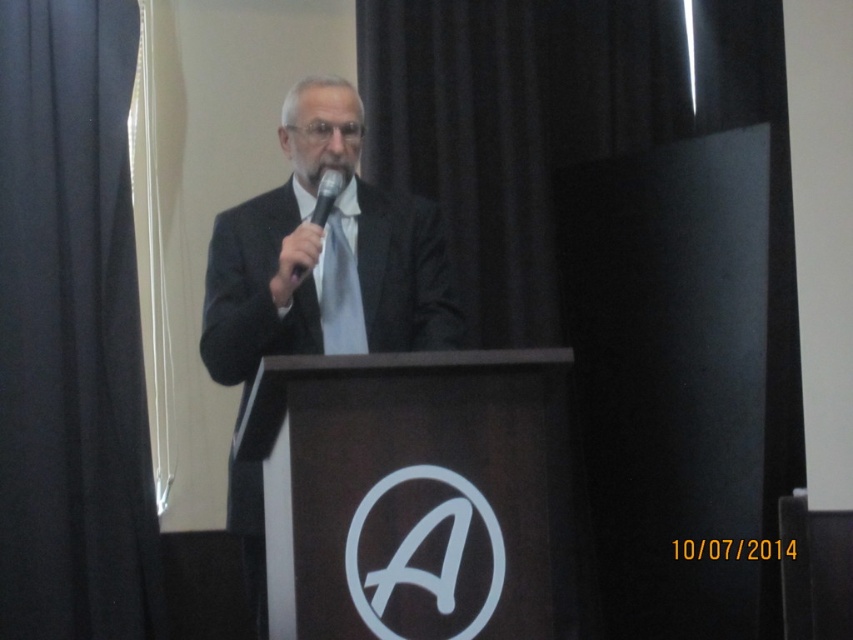
What do you see at coordinates (619, 268) in the screenshot?
I see `black matte curtain at upper left` at bounding box center [619, 268].

Does black matte curtain at upper left appear over black matte microphone at center?

Yes, black matte curtain at upper left is above black matte microphone at center.

Is point (738, 356) closer to camera compared to point (323, 173)?

That is False.

What are the coordinates of `black matte curtain at upper left` in the screenshot? It's located at (619, 268).

Is black fabric curtain at left shorter than black matte microphone at center?

Incorrect, black fabric curtain at left's height does not fall short of black matte microphone at center's.

Can you confirm if black fabric curtain at left is smaller than black matte microphone at center?

Actually, black fabric curtain at left might be larger than black matte microphone at center.

Is point (61, 456) less distant than point (323, 182)?

No, (61, 456) is behind (323, 182).

Locate an element on the screen. The height and width of the screenshot is (640, 853). black fabric curtain at left is located at coordinates (71, 332).

Which is below, black suit at center or gray matte beard at center?

black suit at center is lower down.

Is point (421, 308) behind point (300, 164)?

Yes.

Locate an element on the screen. black suit at center is located at coordinates (323, 280).